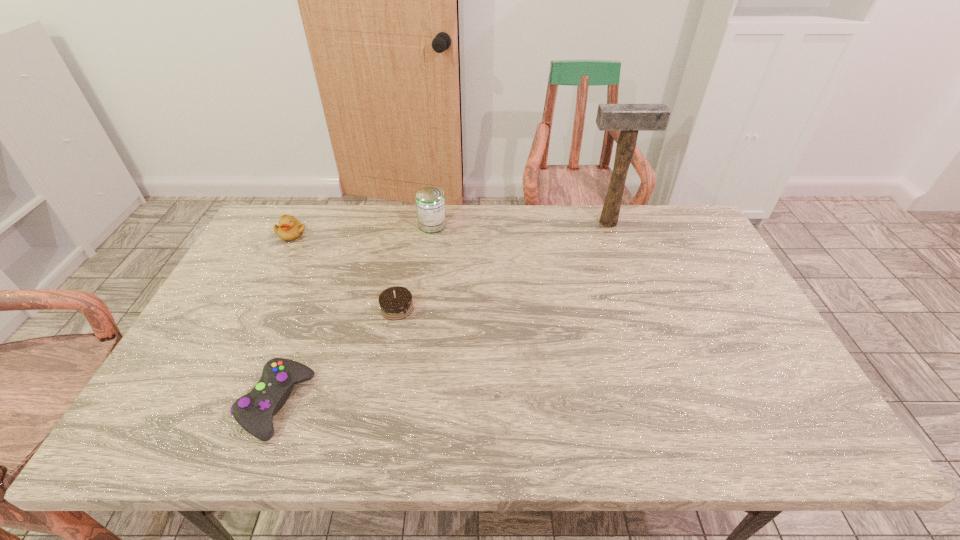
Identify the location of vacant region located 0.230m on the left of the fourth farthest object. (300, 308).

Find the location of a particular element. Image resolution: width=960 pixels, height=540 pixels. vacant area located 0.130m on the back of the control is located at coordinates (304, 329).

This screenshot has width=960, height=540. What are the coordinates of `mallet that is at the far edge` in the screenshot? It's located at (628, 118).

This screenshot has width=960, height=540. I want to click on can that is at the far edge, so click(430, 202).

At what (x,y) coordinates should I click in order to perform the action: click on duckling at the far edge. Please return your answer as a coordinate pair (x, y). This screenshot has height=540, width=960. Looking at the image, I should click on (290, 228).

This screenshot has width=960, height=540. Find the location of `object that is at the near edge`. object that is at the near edge is located at coordinates (254, 412).

Identify the location of object at the left edge. (290, 228).

You are a GUI agent. You are given a task and a screenshot of the screen. Output one action in this format:
    pyautogui.click(x=<x>, y=<y>)
    Task: Click on the object that is at the far left corner
    
    Given the screenshot: What is the action you would take?
    pyautogui.click(x=290, y=228)

Where is `free point at the far edge`? Image resolution: width=960 pixels, height=540 pixels. free point at the far edge is located at coordinates (492, 238).

In the image, there is a desktop. Identify the location of vacant space at the near edge. (x=650, y=448).